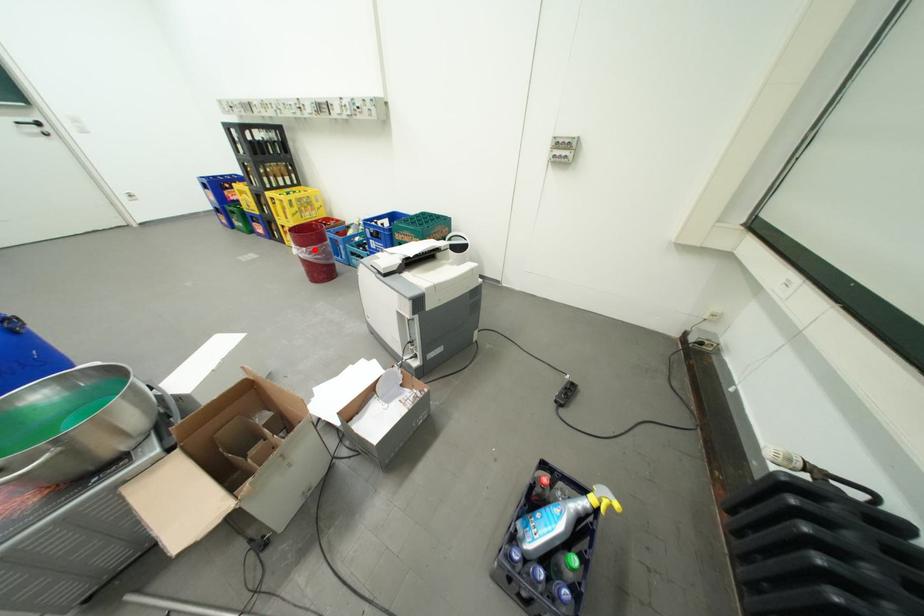
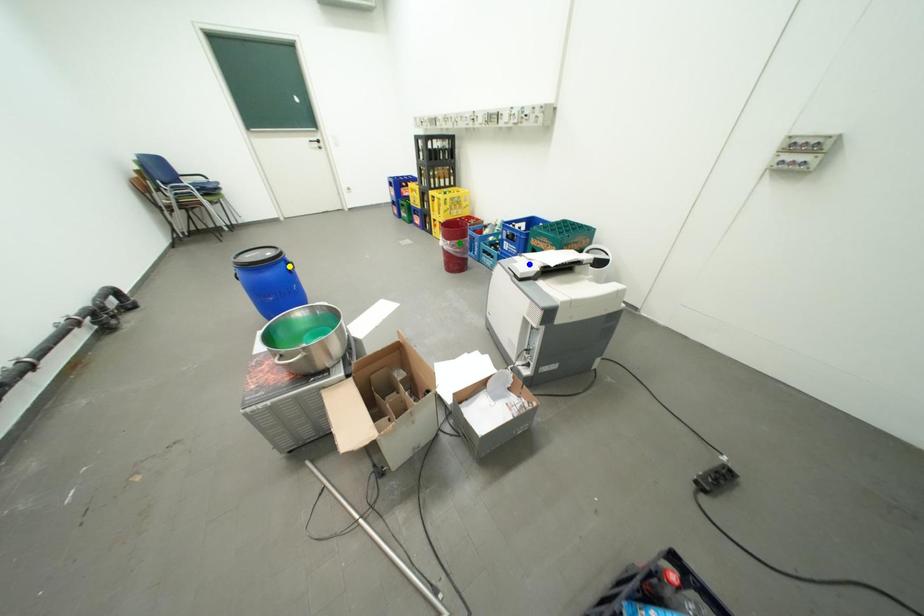
Question: I am providing you with two images of the same scene from different viewpoints. A red point is marked on the first image. You are given multiple points on the second image. Which point in image 2 represents the same 3d spot as the red point in image 1?

Choices:
 (A) yellow point
 (B) green point
 (C) blue point

Answer: (B)